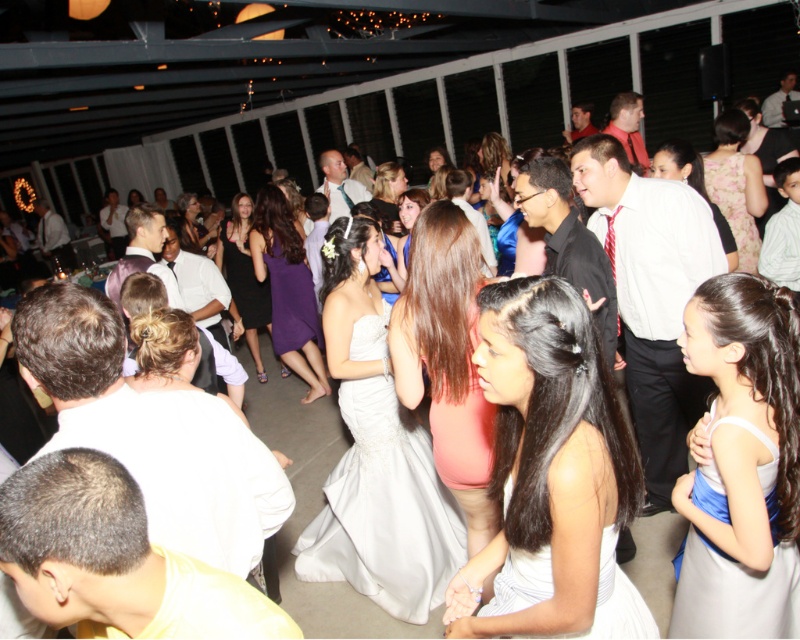
Which is behind, point (450, 408) or point (276, 310)?

Point (276, 310)

Can you confirm if pink satin dress at center is positioned to the left of purple satin dress at center?

No, pink satin dress at center is not to the left of purple satin dress at center.

This screenshot has height=640, width=800. What are the coordinates of `pink satin dress at center` in the screenshot? It's located at (462, 428).

Who is higher up, pink satin dress at center or floral-patterned fabric dress at upper right?

Positioned higher is floral-patterned fabric dress at upper right.

The width and height of the screenshot is (800, 640). What do you see at coordinates (462, 428) in the screenshot?
I see `pink satin dress at center` at bounding box center [462, 428].

I want to click on pink satin dress at center, so click(x=462, y=428).

Who is lower down, white satin dress at lower center or floral-patterned fabric dress at upper right?

white satin dress at lower center is lower down.

Can you confirm if white satin dress at lower center is wider than floral-patterned fabric dress at upper right?

Yes, white satin dress at lower center is wider than floral-patterned fabric dress at upper right.

Which is behind, point (508, 589) or point (746, 196)?

Positioned behind is point (746, 196).

The image size is (800, 640). I want to click on white satin dress at lower center, so click(613, 600).